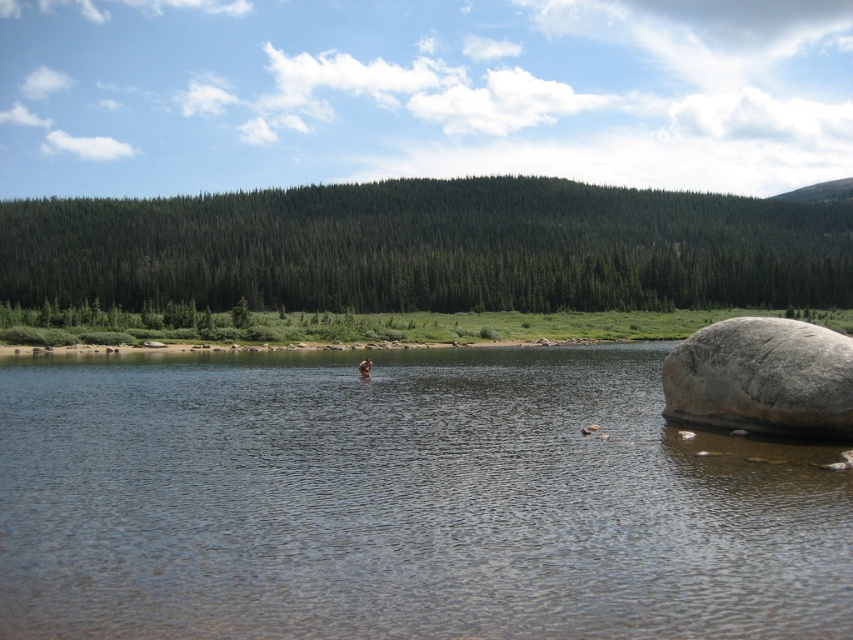
You are standing at the edge of the water and want to reach the gray granite boulder at right without getting wet. The smooth skin person at center is in your way. Can you walk around them to reach the boulder?

The gray granite boulder at right and smooth skin person at center are 26.38 meters apart. Since the person is in your path, you can walk around them as there is enough space between them and the boulder to navigate around without getting too close.

You are standing at the edge of the water and see the point labeled as point [402,500]. Based on the scene description, what is the location of this point relative to the large smooth rock on the right side of the frame?

The point [402,500] corresponds to clear water at center, which is away from the large smooth rock on the right side of the frame.

You are standing at the edge of the water in the serene landscape and notice two points marked in the image. The first point is at coordinates point (627, 579) and the second is at point (735, 365). Which point is nearer to your current position?

Point (627, 579) is closer to the camera than point (735, 365), so the first point is nearer to your current position.